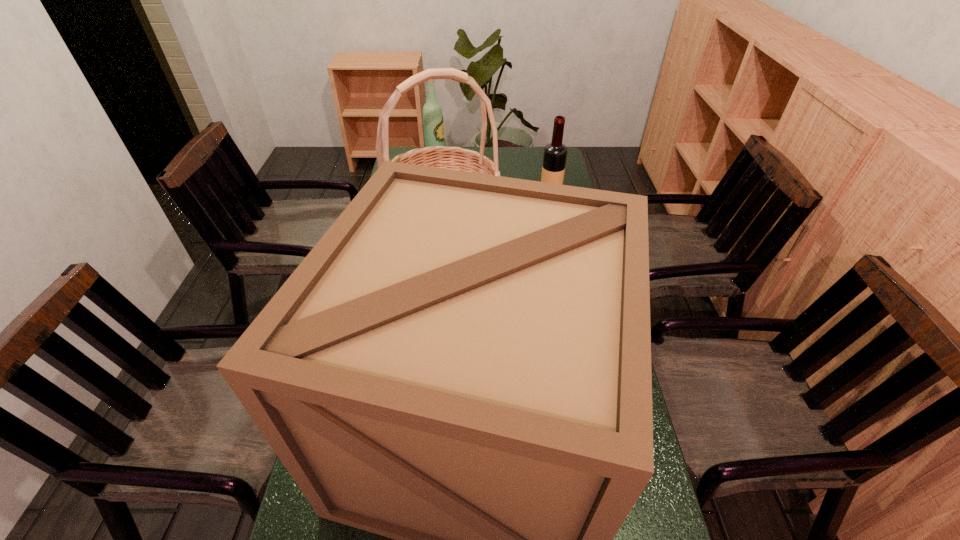
In order to click on free space that satisfies the following two spatial constraints: 1. on the back side of the third farthest object; 2. on the front-facing side of the farthest object in this screenshot , I will do pyautogui.click(x=450, y=164).